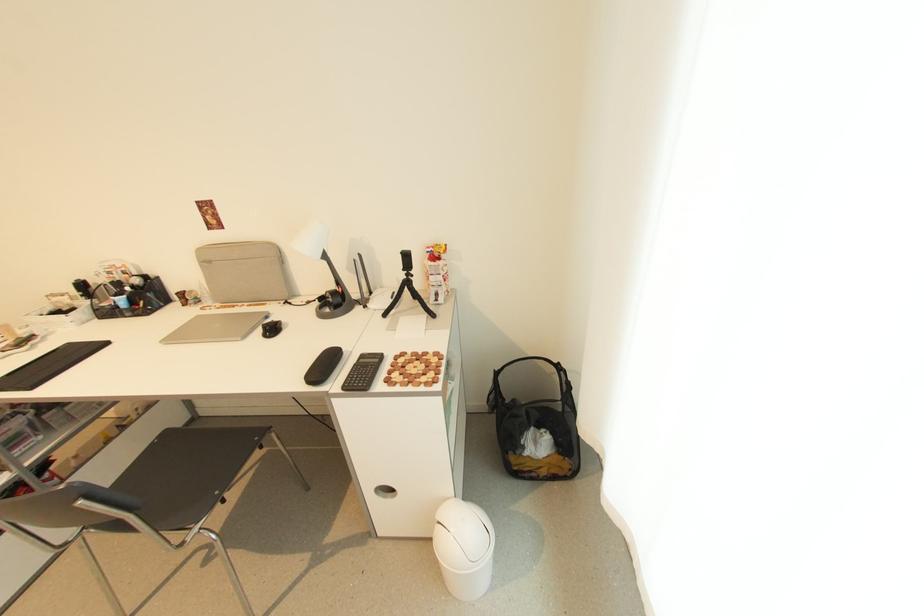
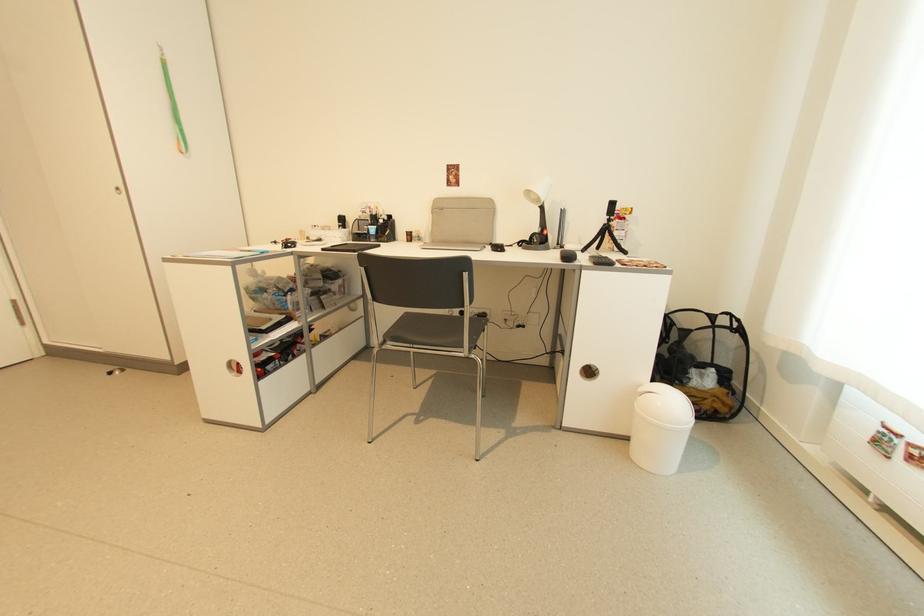
The point at (x=336, y=288) is marked in the first image. Where is the corresponding point in the second image?

(541, 232)